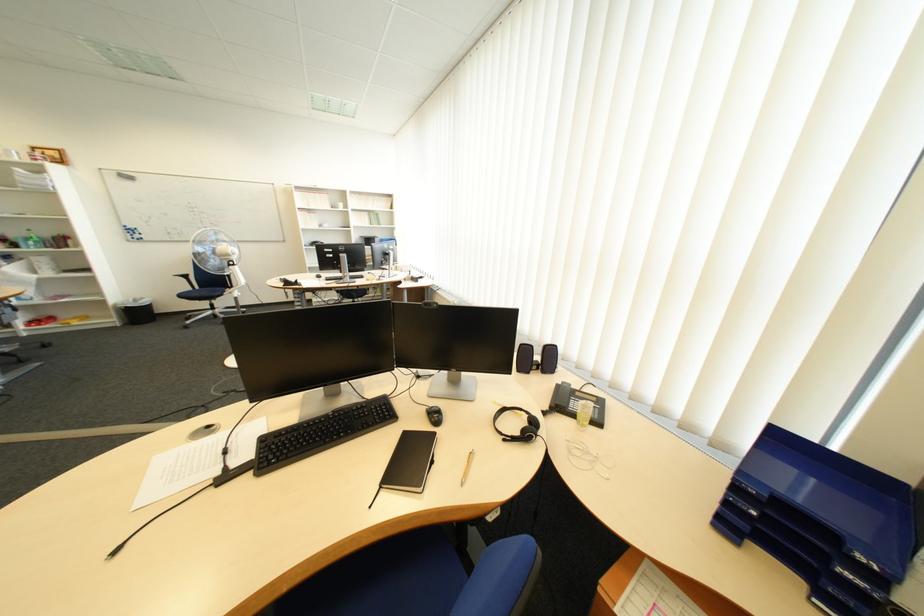
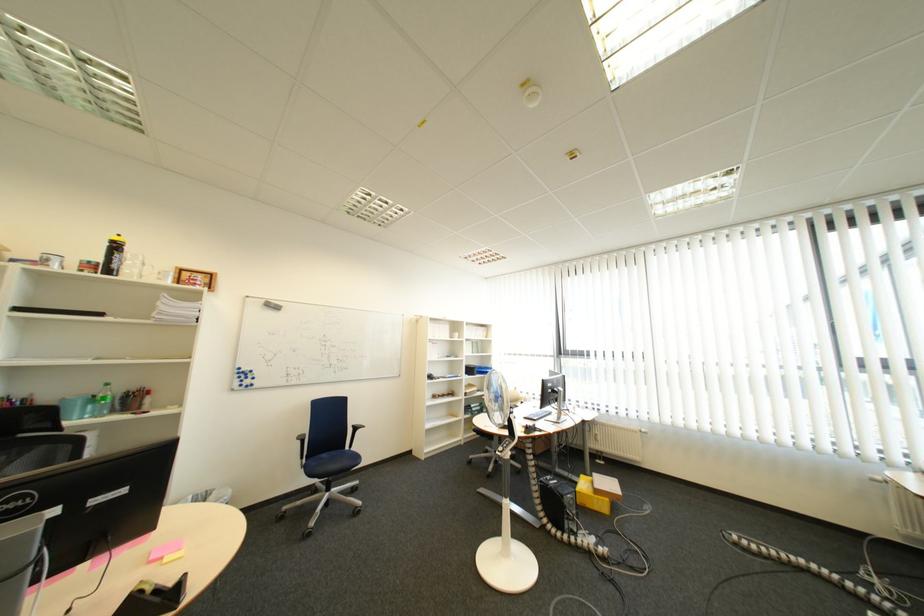
The point at (x=32, y=180) is marked in the first image. Where is the corresponding point in the second image?

(175, 309)